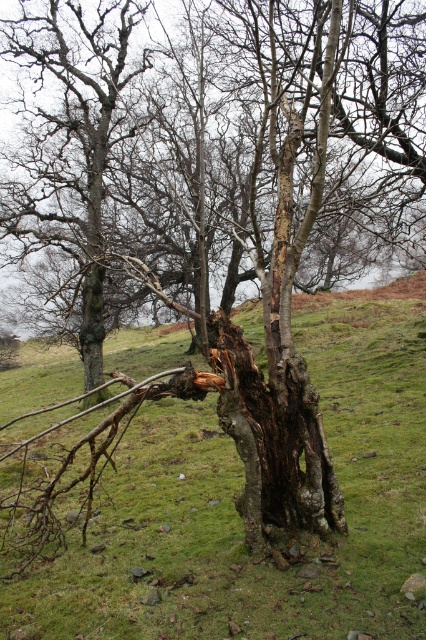
Question: Is the position of green grassy at center less distant than that of dark brown rough bark at center?

Choices:
 (A) yes
 (B) no

Answer: (A)

Question: Which of the following is the farthest from the observer?

Choices:
 (A) (74, 621)
 (B) (310, 461)

Answer: (B)

Question: Does green grassy at center have a greater width compared to dark brown rough bark at center?

Choices:
 (A) yes
 (B) no

Answer: (A)

Question: Does green grassy at center lie in front of dark brown rough bark at center?

Choices:
 (A) no
 (B) yes

Answer: (B)

Question: Which point is closer to the camera?

Choices:
 (A) green grassy at center
 (B) dark brown rough bark at center

Answer: (A)